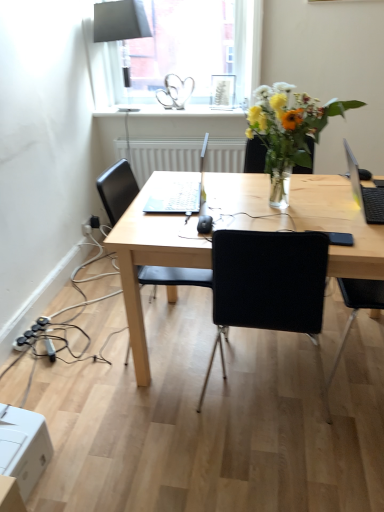
Identify the location of free space that is to the left of light wood desk at center. This screenshot has height=512, width=384. (97, 378).